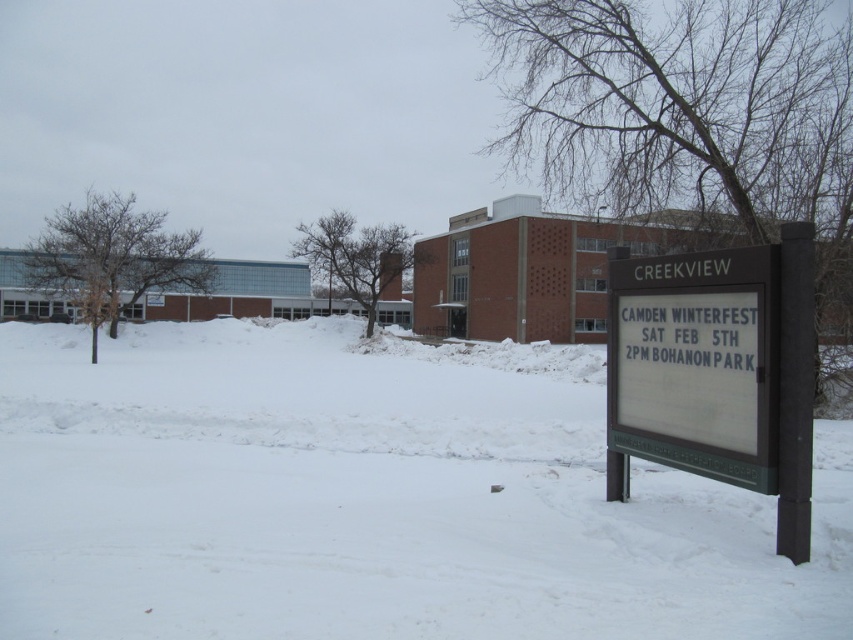
Question: From the image, what is the correct spatial relationship of white powdery snow at center in relation to white wood sign at right?

Choices:
 (A) right
 (B) left

Answer: (B)

Question: Which point is farther to the camera?

Choices:
 (A) (790, 308)
 (B) (834, 531)

Answer: (B)

Question: Which point is closer to the camera?

Choices:
 (A) (354, 332)
 (B) (616, 412)

Answer: (B)

Question: In this image, where is white powdery snow at center located relative to white wood sign at right?

Choices:
 (A) left
 (B) right

Answer: (A)

Question: Is white powdery snow at center above white wood sign at right?

Choices:
 (A) no
 (B) yes

Answer: (A)